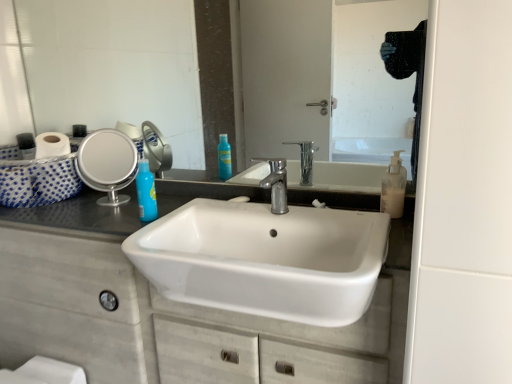
Question: Is glossy glass mirror at upper center, the first mirror in the right-to-left sequence, aimed at white matte cabinet at center?

Choices:
 (A) yes
 (B) no

Answer: (B)

Question: Can white matte cabinet at center be found inside glossy glass mirror at upper center, marked as the second mirror in a left-to-right arrangement?

Choices:
 (A) no
 (B) yes

Answer: (A)

Question: From the image's perspective, is glossy glass mirror at upper center, the first mirror in the right-to-left sequence, over white matte cabinet at center?

Choices:
 (A) no
 (B) yes

Answer: (B)

Question: Does glossy glass mirror at upper center, the first mirror in the right-to-left sequence, come behind white matte cabinet at center?

Choices:
 (A) no
 (B) yes

Answer: (B)

Question: Are glossy glass mirror at upper center, the first mirror in the right-to-left sequence, and white matte cabinet at center far apart?

Choices:
 (A) yes
 (B) no

Answer: (B)

Question: Can you confirm if glossy glass mirror at upper center, the first mirror in the right-to-left sequence, is smaller than white matte cabinet at center?

Choices:
 (A) no
 (B) yes

Answer: (B)

Question: Is blue glossy bottle at upper left positioned behind translucent plastic soap dispenser at right?

Choices:
 (A) no
 (B) yes

Answer: (B)

Question: Is blue glossy bottle at upper left oriented towards translucent plastic soap dispenser at right?

Choices:
 (A) no
 (B) yes

Answer: (A)

Question: Considering the relative sizes of blue glossy bottle at upper left and translucent plastic soap dispenser at right in the image provided, is blue glossy bottle at upper left wider than translucent plastic soap dispenser at right?

Choices:
 (A) no
 (B) yes

Answer: (A)

Question: Is blue glossy bottle at upper left oriented away from translucent plastic soap dispenser at right?

Choices:
 (A) no
 (B) yes

Answer: (A)

Question: Does blue glossy bottle at upper left have a smaller size compared to translucent plastic soap dispenser at right?

Choices:
 (A) no
 (B) yes

Answer: (A)

Question: Can you confirm if blue glossy bottle at upper left is thinner than translucent plastic soap dispenser at right?

Choices:
 (A) yes
 (B) no

Answer: (A)

Question: From a real-world perspective, is polished chrome faucet at center physically below white ceramic sink at center?

Choices:
 (A) yes
 (B) no

Answer: (B)